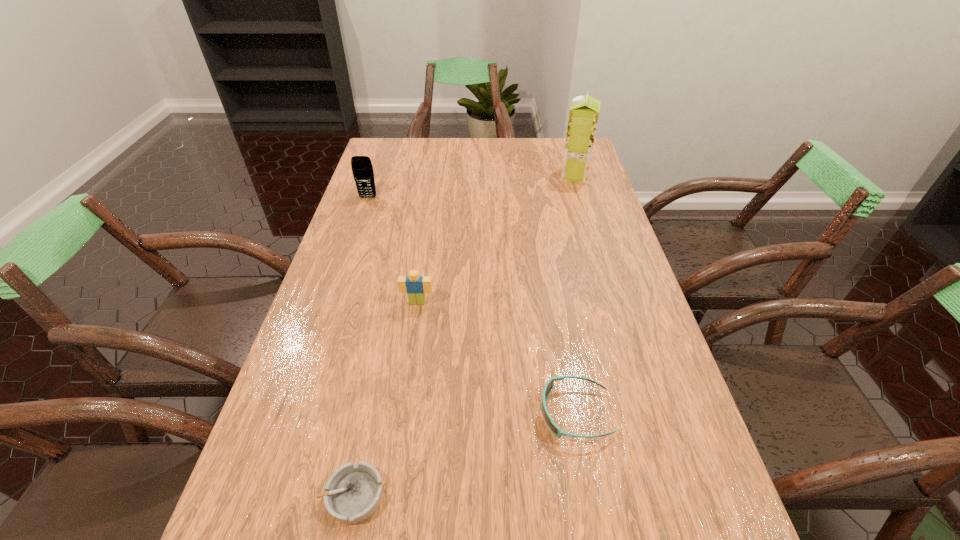
Where is `blank region between the ashtray and the leftmost object`? The image size is (960, 540). blank region between the ashtray and the leftmost object is located at coordinates (360, 347).

Identify the location of vacant area between the third farthest object and the second object from right to left. (496, 357).

Where is `free space between the fourth object from left to right and the Lego`? Image resolution: width=960 pixels, height=540 pixels. free space between the fourth object from left to right and the Lego is located at coordinates (496, 357).

Locate an element on the screen. The image size is (960, 540). empty location between the third shortest object and the second nearest object is located at coordinates (496, 357).

The width and height of the screenshot is (960, 540). I want to click on free space between the soya milk and the Lego, so click(x=496, y=239).

Image resolution: width=960 pixels, height=540 pixels. I want to click on free spot between the leftmost object and the ashtray, so click(360, 347).

Find the location of a particular element. The width and height of the screenshot is (960, 540). object that stands as the fourth closest to the soya milk is located at coordinates (354, 492).

Locate an element on the screen. This screenshot has width=960, height=540. object that stands as the third closest to the nearest object is located at coordinates pos(362,169).

Find the location of a particular element. Image resolution: width=960 pixels, height=540 pixels. vacant area that satisfies the following two spatial constraints: 1. on the screen of the leftmost object; 2. on the right side of the shortest object is located at coordinates (267, 496).